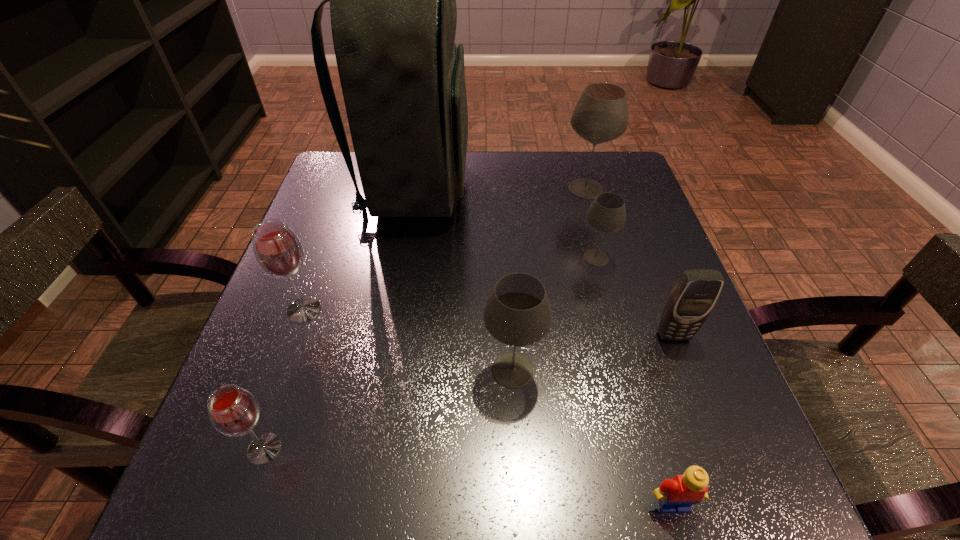
Find the location of a particular element. This screenshot has height=540, width=960. vacant area that lies between the farthest wineglass and the nearest wineglass is located at coordinates (425, 319).

Find the location of a particular element. This screenshot has height=540, width=960. vacant space in between the farthest gray wineglass and the tallest object is located at coordinates (500, 188).

Where is `free space between the fourth farthest object and the seventh shortest object`? free space between the fourth farthest object and the seventh shortest object is located at coordinates (444, 249).

Image resolution: width=960 pixels, height=540 pixels. I want to click on vacant area that lies between the shortest object and the seventh farthest object, so click(x=468, y=476).

Where is `vacant space in between the third farthest object and the Lego`? The width and height of the screenshot is (960, 540). vacant space in between the third farthest object and the Lego is located at coordinates (635, 381).

The width and height of the screenshot is (960, 540). I want to click on vacant area that lies between the backpack and the nearest wineglass, so click(x=340, y=319).

The height and width of the screenshot is (540, 960). I want to click on vacant space in between the second nearest wineglass and the farther red wineglass, so click(x=408, y=340).

Identify the location of unoccupied position between the bigger red wineglass and the nearer red wineglass. (284, 379).

The width and height of the screenshot is (960, 540). I want to click on free space between the fifth farthest object and the smallest gray wineglass, so click(635, 297).

The width and height of the screenshot is (960, 540). I want to click on the sixth closest object to the gray backpack, so click(233, 411).